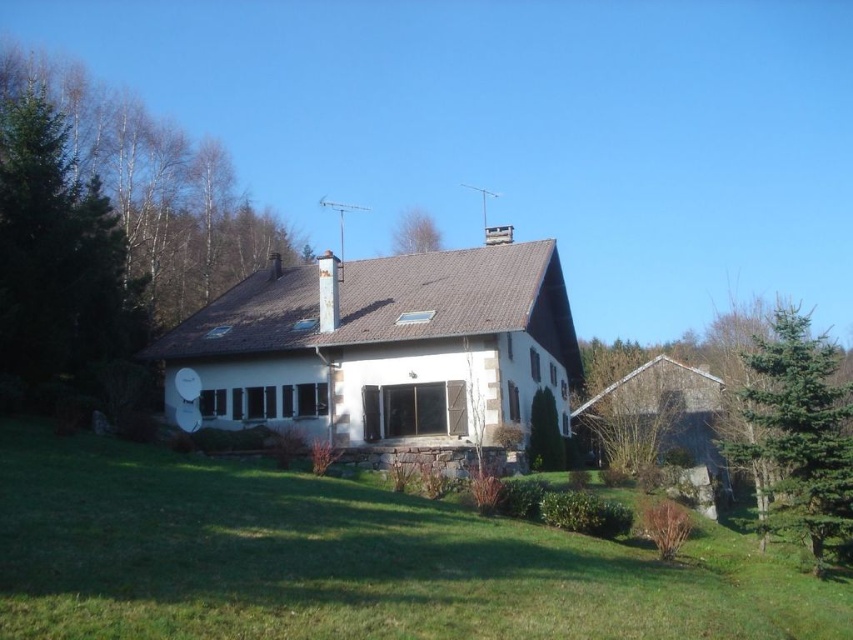
You are standing in front of the house and see the green grass at lower center and the green leafy tree at upper center. Which object is positioned to the right of the other?

The green grass at lower center is to the right of the green leafy tree at upper center.